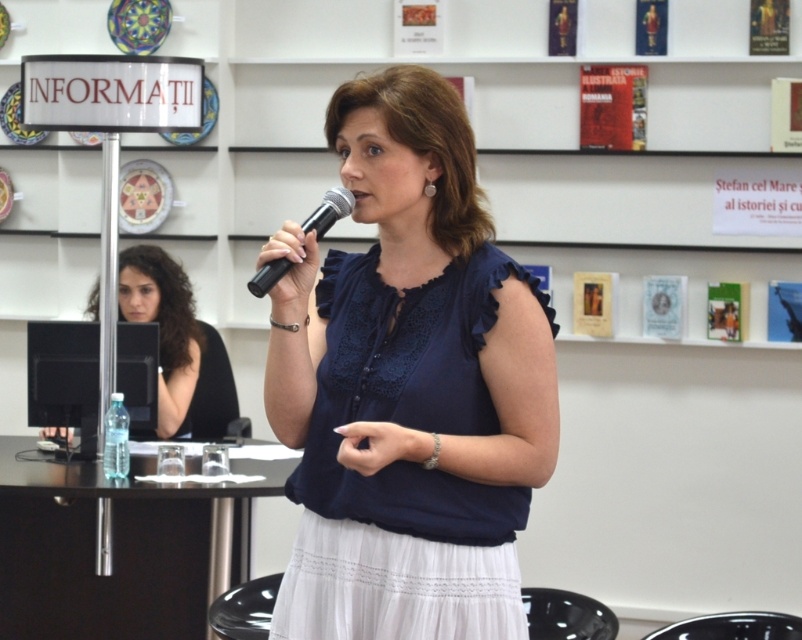
You are an event organizer who needs to adjust the microphone stand to ensure the black plastic microphone at center is at a comfortable speaking height for the woman wearing the black fabric shirt at center. Based on the scene description, what adjustment should you make to the microphone stand?

The black fabric shirt at center is much taller than the black plastic microphone at center, so you should raise the microphone stand to match the speaker height.

You are an event organizer checking the attire of participants in the image. You notice both the matte blue blouse at center and the black fabric shirt at center. Which one is taller in height?

The matte blue blouse at center has a greater height compared to the black fabric shirt at center.